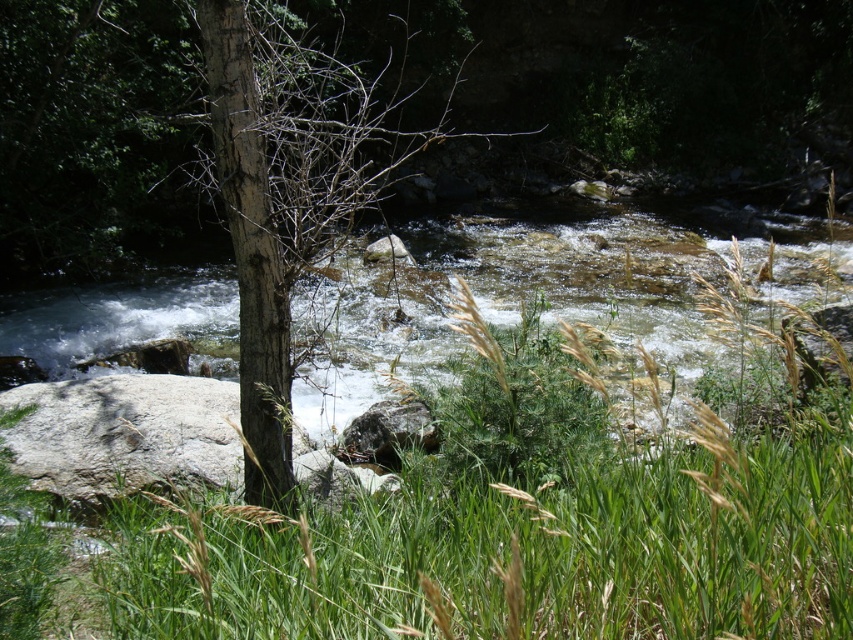
Question: Can you confirm if brown rough tree trunk at center-left is wider than gray rough rock at center?

Choices:
 (A) yes
 (B) no

Answer: (A)

Question: Is brown rough tree trunk at center-left further to camera compared to gray rough rock at center?

Choices:
 (A) no
 (B) yes

Answer: (A)

Question: Which of the following is the closest to the observer?

Choices:
 (A) brown rough tree trunk at center-left
 (B) gray smooth rock at center

Answer: (A)

Question: Considering the real-world distances, which object is farthest from the brown rough tree trunk at center-left?

Choices:
 (A) gray rough rock at center
 (B) gray smooth rock at center
 (C) clear water at center

Answer: (B)

Question: Which is farther from the brown rough tree trunk at center-left?

Choices:
 (A) gray smooth rock at center
 (B) gray rough rock at center
 (C) clear water at center

Answer: (A)

Question: Is clear water at center smaller than gray smooth rock at center?

Choices:
 (A) no
 (B) yes

Answer: (A)